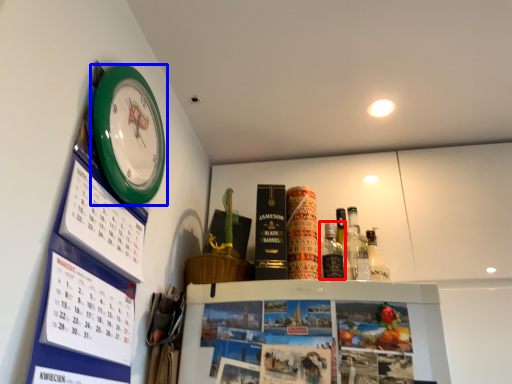
Question: Which object appears farthest to the camera in this image, bottle (highlighted by a red box) or wall clock (highlighted by a blue box)?

Choices:
 (A) bottle
 (B) wall clock

Answer: (A)